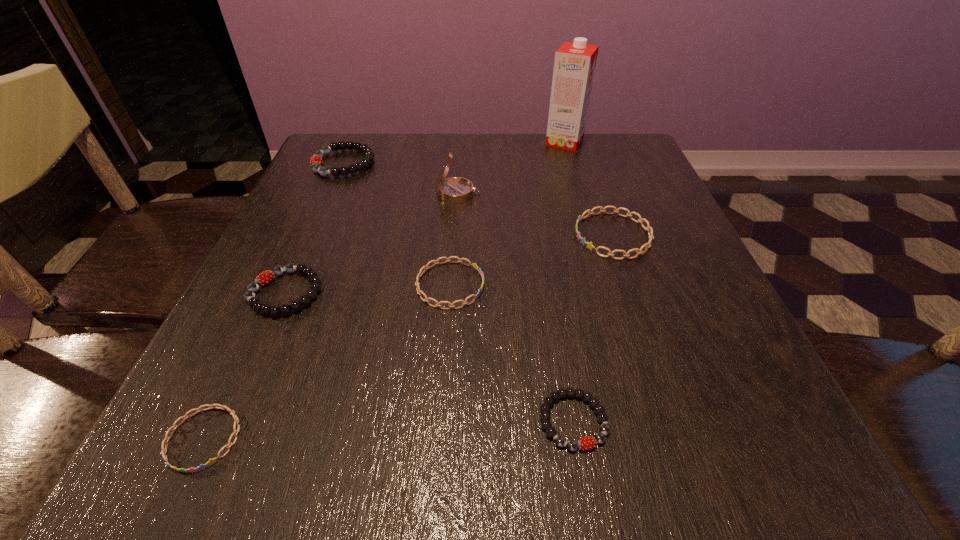
This screenshot has width=960, height=540. In order to click on vacant point at the far edge in this screenshot , I will do `click(490, 147)`.

Find the location of a particular element. This screenshot has width=960, height=540. free spot at the near edge of the desktop is located at coordinates (392, 482).

Locate an element on the screen. The width and height of the screenshot is (960, 540). free space at the left edge is located at coordinates (225, 362).

In the image, there is a desktop. At what (x,y) coordinates should I click in order to perform the action: click on free space at the far left corner. Please return your answer as a coordinate pair (x, y). The image size is (960, 540). Looking at the image, I should click on (374, 134).

Identify the location of vacant area at the near left corner. The height and width of the screenshot is (540, 960). (252, 447).

Locate an element on the screen. blank area at the far right corner is located at coordinates (610, 133).

Find the location of a particular element. This screenshot has width=960, height=540. vacant space at the near right corner of the desktop is located at coordinates (714, 423).

Find the location of `empty space between the second biggest black bracelet and the rightmost bracelet`. empty space between the second biggest black bracelet and the rightmost bracelet is located at coordinates (449, 264).

The height and width of the screenshot is (540, 960). I want to click on free space between the smallest black bracelet and the compass, so click(516, 307).

Locate an element on the screen. This screenshot has height=540, width=960. unoccupied position between the second nearest blue bracelet and the fifth bracelet from left to right is located at coordinates (512, 353).